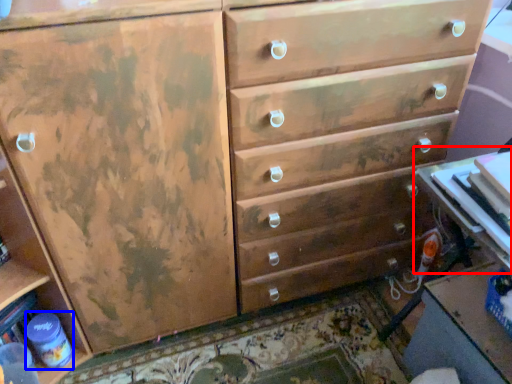
Question: Which point is closer to the camera, table (highlighted by a red box) or bottle (highlighted by a blue box)?

Choices:
 (A) table
 (B) bottle

Answer: (A)